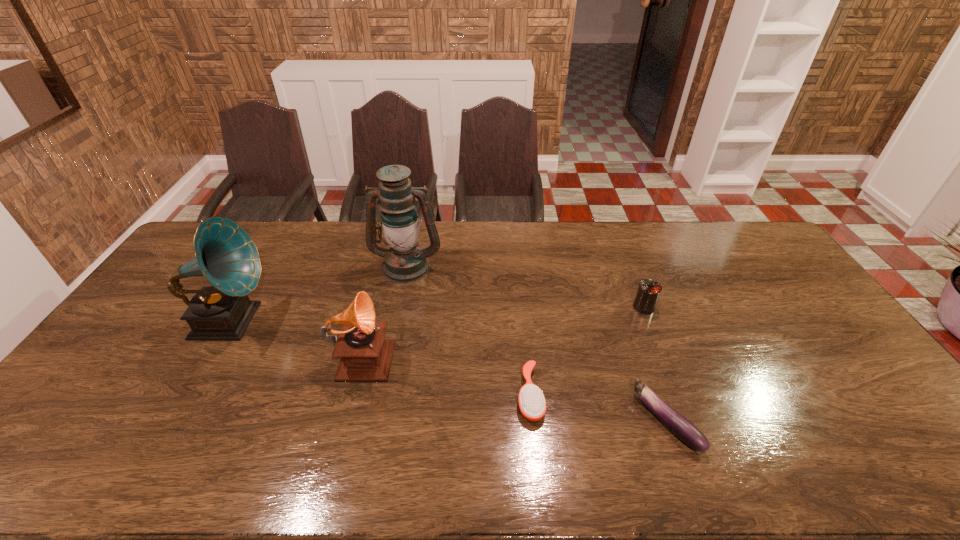
Identify the location of oil lamp. The width and height of the screenshot is (960, 540). (405, 261).

I want to click on the leftmost object, so click(x=225, y=254).

Locate an element on the screen. The width and height of the screenshot is (960, 540). the left phonograph record is located at coordinates (225, 254).

I want to click on the shorter phonograph record, so click(365, 356).

Locate an element on the screen. This screenshot has height=540, width=960. the right phonograph record is located at coordinates (365, 356).

Locate an element on the screen. the third shortest object is located at coordinates (648, 292).

At what (x,y) coordinates should I click in order to perform the action: click on eggplant. Please return your answer as a coordinate pair (x, y). This screenshot has height=540, width=960. Looking at the image, I should click on (681, 427).

This screenshot has width=960, height=540. What are the coordinates of `the fourth object from left to right` in the screenshot? It's located at (532, 404).

The height and width of the screenshot is (540, 960). I want to click on free space located on the right of the farthest object, so click(x=553, y=266).

Where is `vacant space located from the horn of the taller phonograph record`? vacant space located from the horn of the taller phonograph record is located at coordinates [x=393, y=321].